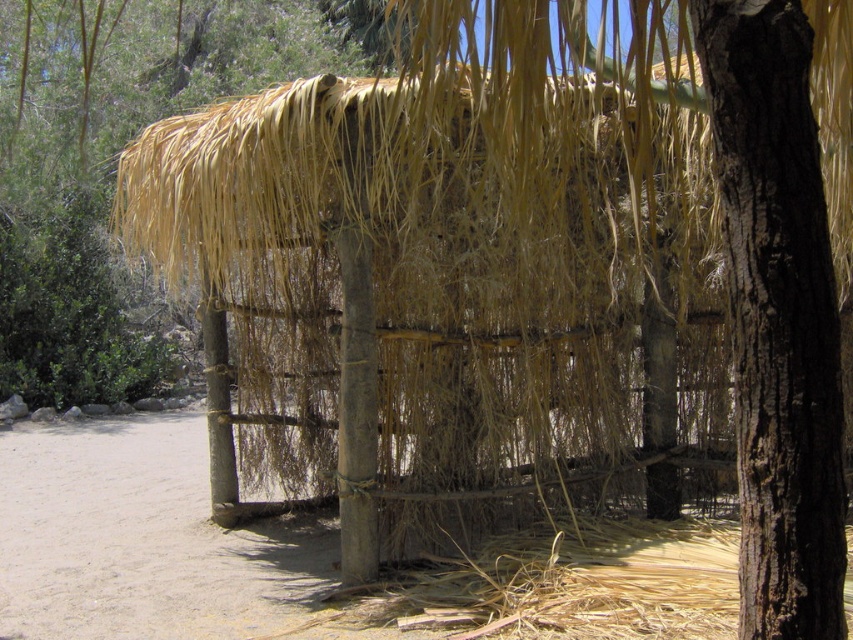
Image resolution: width=853 pixels, height=640 pixels. What are the coordinates of `brown rough bark tree at center` in the screenshot? It's located at (776, 316).

Does brown rough bark tree at center have a greater height compared to brown rough wood pole at center?

Yes.

Is point (804, 627) farther from viewer compared to point (212, 358)?

No, it is in front of (212, 358).

This screenshot has width=853, height=640. I want to click on brown rough bark tree at center, so click(x=776, y=316).